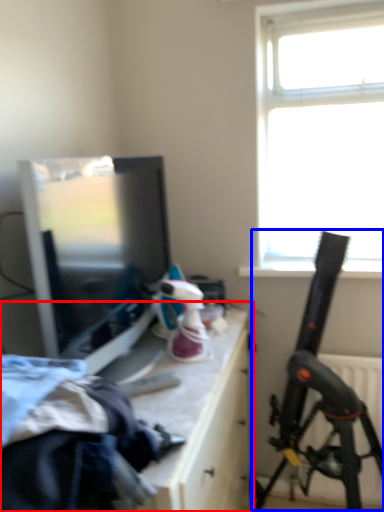
Question: Which object is further to the camera taking this photo, table (highlighted by a red box) or weapon (highlighted by a blue box)?

Choices:
 (A) table
 (B) weapon

Answer: (B)